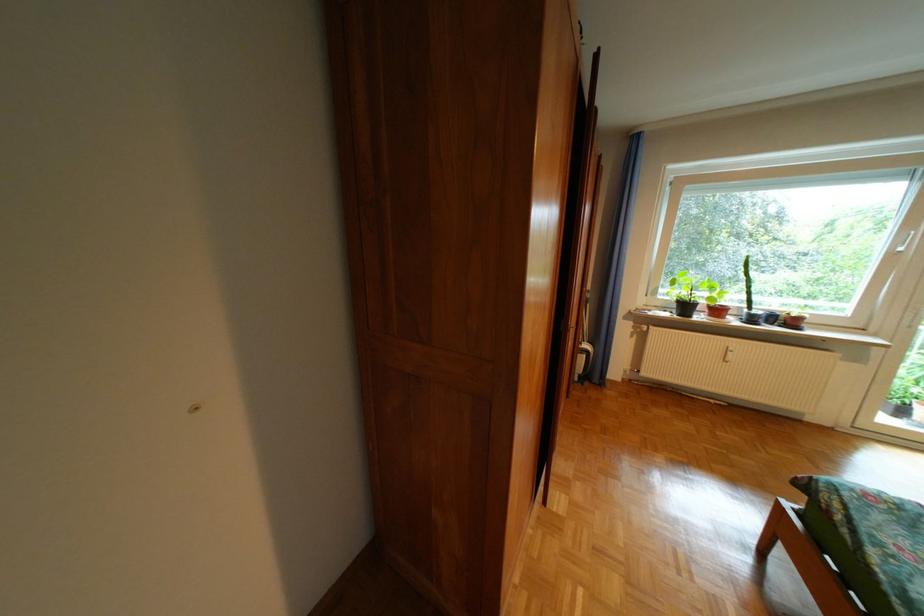
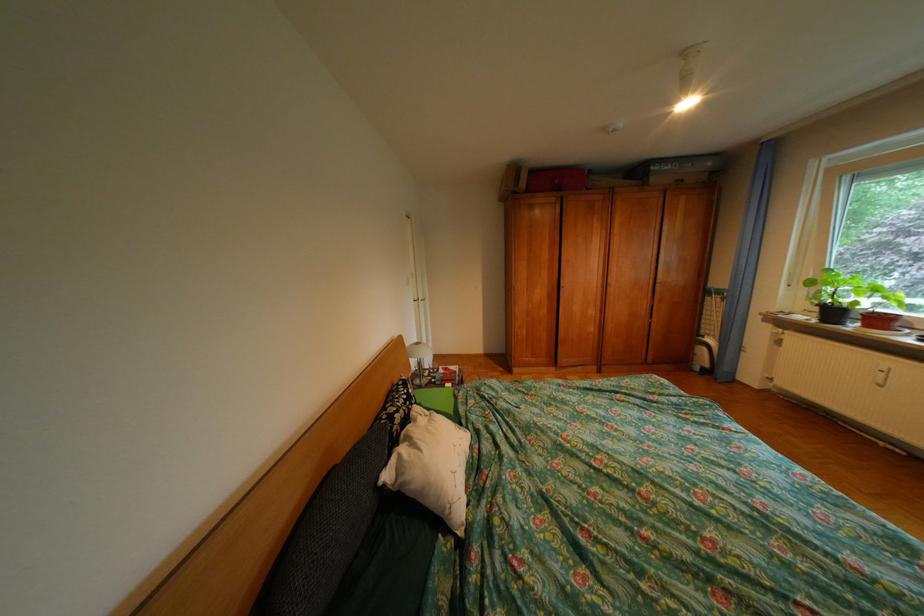
Where in the second image is the point corresponding to (x=679, y=315) from the first image?

(819, 318)